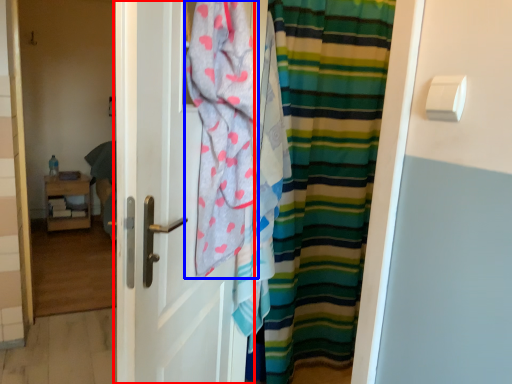
Question: Which object appears closest to the camera in this image, door (highlighted by a red box) or beach towel (highlighted by a blue box)?

Choices:
 (A) door
 (B) beach towel

Answer: (A)